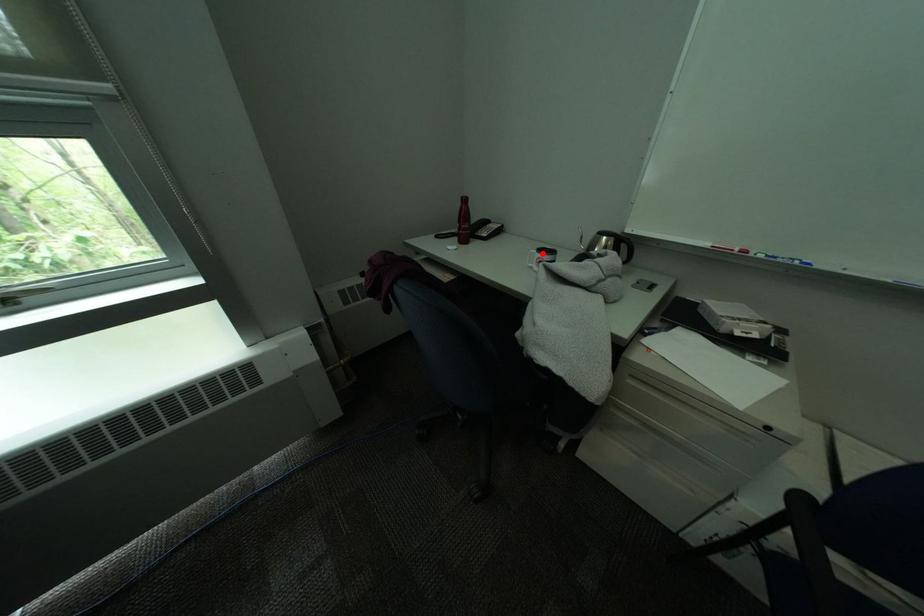
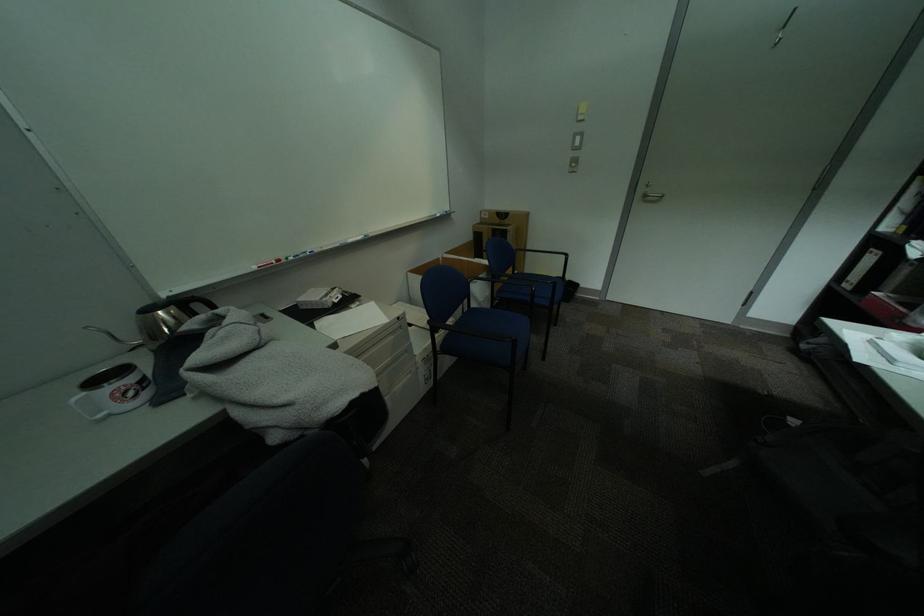
The point at the highlighted location is marked in the first image. Where is the corresponding point in the second image?

(90, 400)